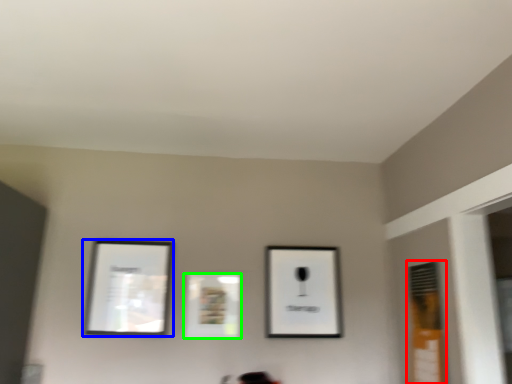
Question: Which object is positioned closest to window (highlighted by a red box)? Select from picture frame (highlighted by a blue box) and picture frame (highlighted by a green box).

Choices:
 (A) picture frame
 (B) picture frame

Answer: (B)